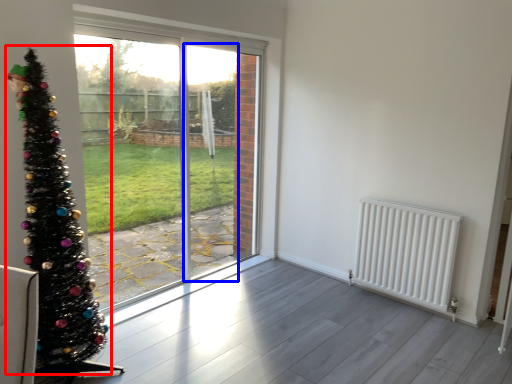
Question: Which of the following is the farthest to the observer, christmas tree (highlighted by a red box) or screen door (highlighted by a blue box)?

Choices:
 (A) christmas tree
 (B) screen door

Answer: (B)